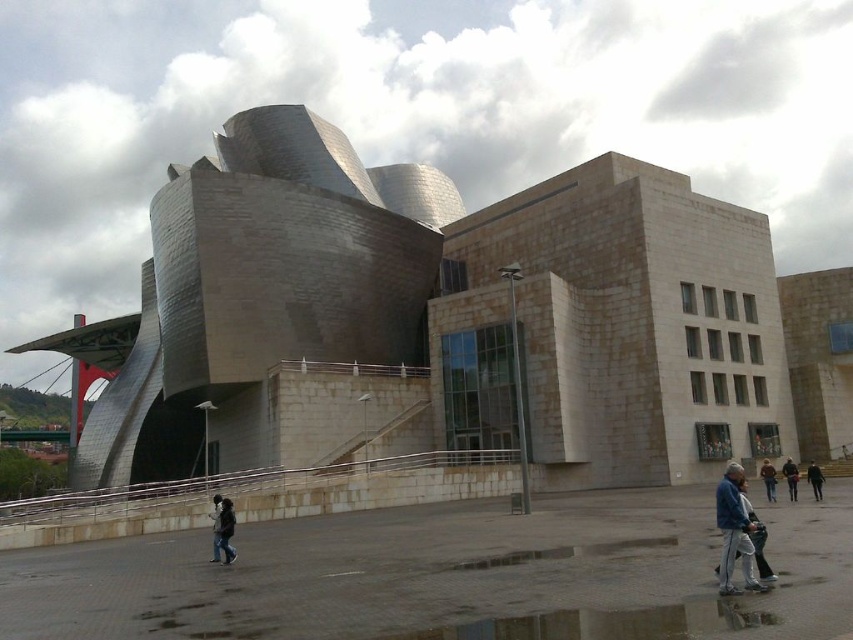
Does point (741, 497) come closer to viewer compared to point (792, 486)?

Yes, point (741, 497) is in front of point (792, 486).

Identify the location of light gray fabric jacket at lower right. The height and width of the screenshot is (640, 853). (756, 538).

The height and width of the screenshot is (640, 853). Describe the element at coordinates (756, 538) in the screenshot. I see `light gray fabric jacket at lower right` at that location.

Locate an element on the screen. The height and width of the screenshot is (640, 853). light gray fabric jacket at lower right is located at coordinates (756, 538).

Who is more forward, (775, 492) or (819, 483)?

Point (819, 483) is more forward.

Does brown leather jacket at lower right appear over black leather jacket at lower right?

Correct, brown leather jacket at lower right is located above black leather jacket at lower right.

Is point (763, 477) positioned before point (811, 474)?

That is False.

This screenshot has height=640, width=853. I want to click on brown leather jacket at lower right, so click(769, 480).

Does dark blue jacket at lower right have a greater height compared to black leather jacket at lower right?

Yes.

Which is more to the right, dark blue jacket at lower right or black leather jacket at lower right?

black leather jacket at lower right

Which is behind, point (785, 472) or point (809, 474)?

Positioned behind is point (785, 472).

The image size is (853, 640). Identify the location of dark blue jacket at lower right. (790, 477).